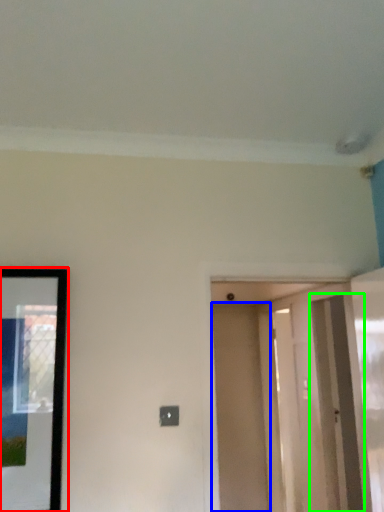
Question: Estimate the real-world distances between objects in this image. Which object is closer to picture frame (highlighted by a red box), door (highlighted by a blue box) or screen door (highlighted by a green box)?

Choices:
 (A) door
 (B) screen door

Answer: (B)